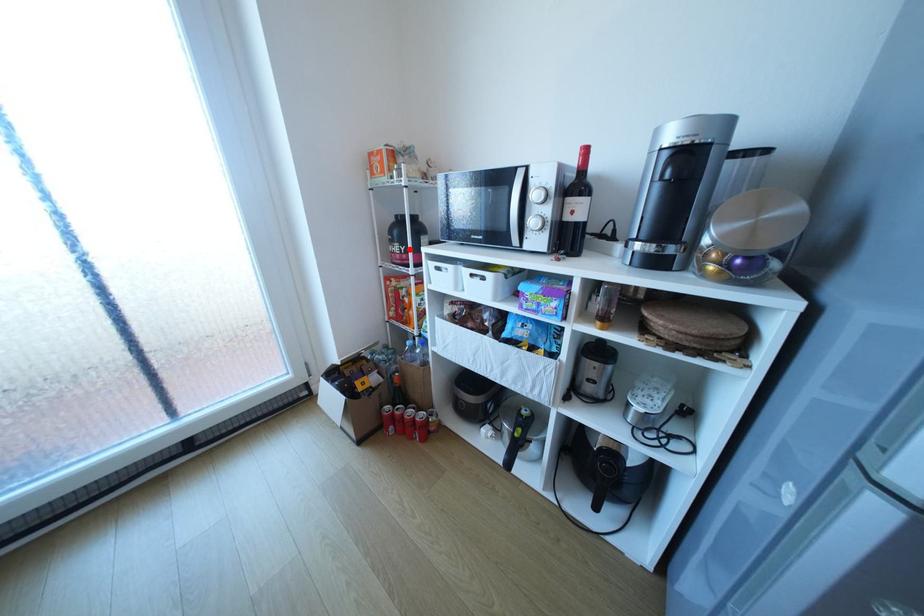
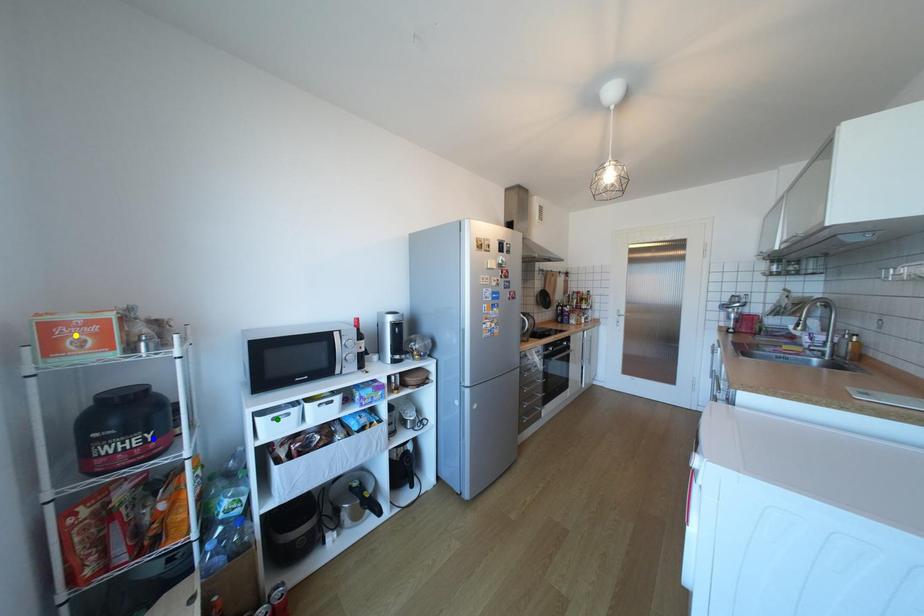
Question: I am providing you with two images of the same scene from different viewpoints. A red point is marked on the first image. You are given multiple points on the second image. Which point in image 2 represents the same 3d spot as the red point in image 1?

Choices:
 (A) yellow point
 (B) green point
 (C) blue point

Answer: (C)